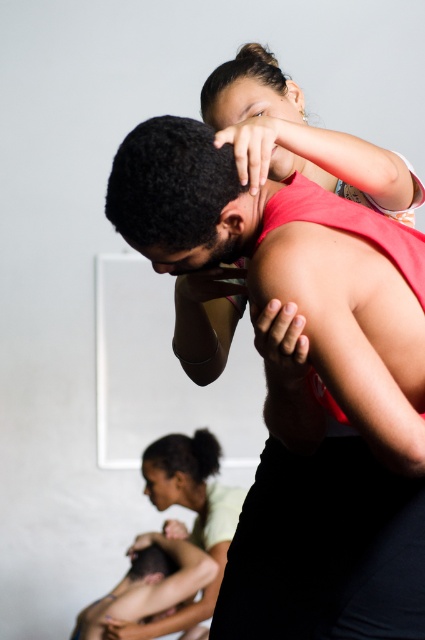
You are a costume designer preparing for a performance. You have two tank tops available, the matte red tank top at center and the matte pink tank top at upper center. The lead actor needs a tank top that can accommodate their larger frame. Which tank top should they choose?

The matte red tank top at center has a larger size compared to the matte pink tank top at upper center, so the lead actor should choose the matte red tank top at center to accommodate their larger frame.

Based on the photo, you are a photographer trying to capture a photo of the matte red tank top at center and the matte pink tank top at upper center. Which one should you focus on if you want to highlight the one that is much taller?

The matte red tank top at center is much taller than the matte pink tank top at upper center, so you should focus on the matte red tank top at center to highlight its height.

Looking at the scene, where is the matte red tank top at center in relation to the matte pink tank top at upper center?

The matte red tank top at center is to the left of the matte pink tank top at upper center.